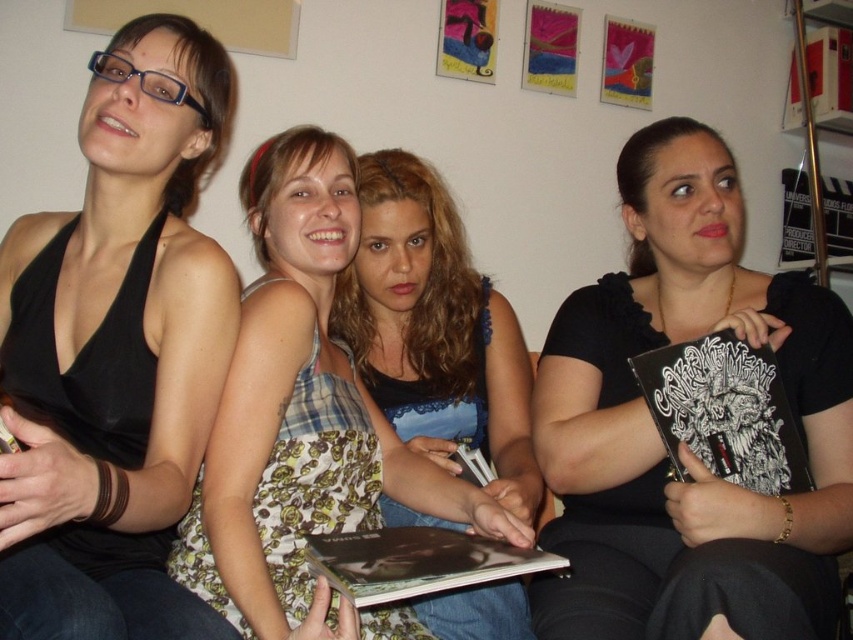
You are a photographer trying to capture a candid shot of the black matte tank top at left and the black matte book at center. Since the camera can only focus on one object at a time, which object should you focus on to ensure the other is still in the frame?

The black matte tank top at left is above the black matte book at center, so focusing on the black matte tank top at left would keep the black matte book at center in the frame below it.

You are trying to decide whether to place a new shelf above the black matte book at center and the plaid fabric dress at center. Since the shelf needs to be placed higher than both items, which item determines the minimum height required for the shelf?

The black matte book at center is much taller than the plaid fabric dress at center, so the shelf must be placed higher than the black matte book at center to accommodate its height.

You are a photographer trying to capture a group photo of the black matte tank top at left and the plaid fabric dress at center. Which person should you adjust to ensure both are in focus? Explain your reasoning based on their positions.

The black matte tank top at left is taller than the plaid fabric dress at center. To ensure both are in focus, adjust the camera angle to account for the height difference, focusing on the midpoint between them.